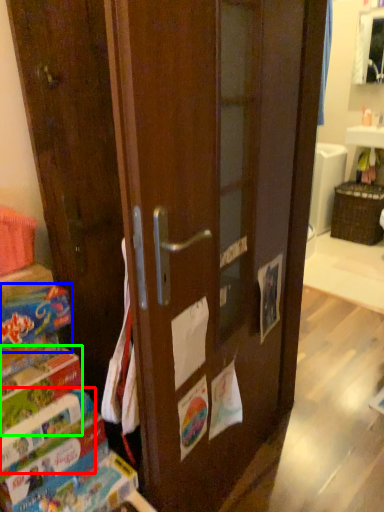
Question: Which object is the closest to the paperback book (highlighted by a red box)? Choose among these: paperback book (highlighted by a blue box) or paperback book (highlighted by a green box).

Choices:
 (A) paperback book
 (B) paperback book

Answer: (B)